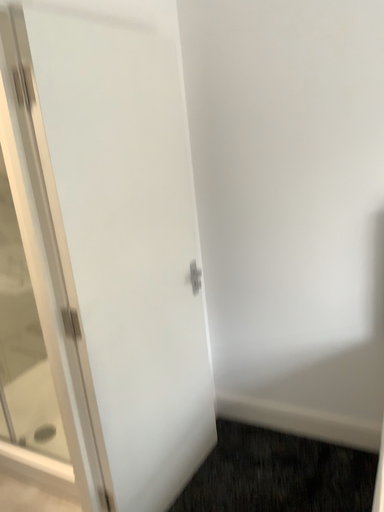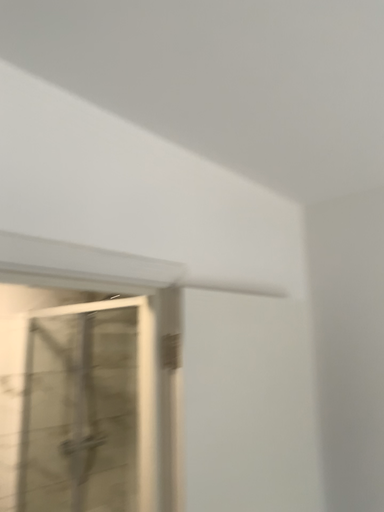
Question: Which way did the camera rotate in the video?

Choices:
 (A) rotated right
 (B) rotated left

Answer: (B)